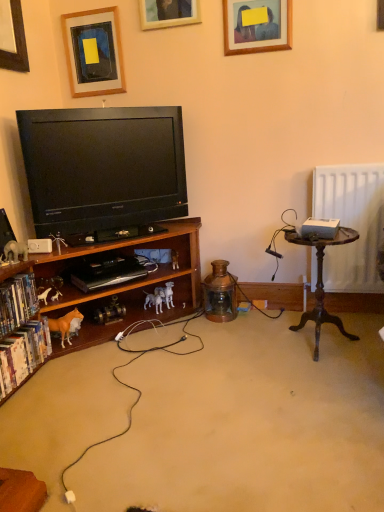
Question: Is wooden picture frame at upper center, which ranks as the 1th picture frame in right-to-left order, next to white plastic speaker at lower left?

Choices:
 (A) yes
 (B) no

Answer: (B)

Question: Can you confirm if wooden picture frame at upper center, which ranks as the 1th picture frame in right-to-left order, is bigger than white plastic speaker at lower left?

Choices:
 (A) no
 (B) yes

Answer: (B)

Question: Can we say wooden picture frame at upper center, positioned as the 3th picture frame in left-to-right order, lies outside white plastic speaker at lower left?

Choices:
 (A) yes
 (B) no

Answer: (A)

Question: Is white plastic speaker at lower left a part of wooden picture frame at upper center, positioned as the 3th picture frame in left-to-right order?

Choices:
 (A) no
 (B) yes

Answer: (A)

Question: Is wooden picture frame at upper center, which ranks as the 1th picture frame in right-to-left order, positioned far away from white plastic speaker at lower left?

Choices:
 (A) no
 (B) yes

Answer: (B)

Question: Is point (160, 305) closer or farther from the camera than point (26, 254)?

Choices:
 (A) farther
 (B) closer

Answer: (A)

Question: Considering the positions of white plastic dog at lower center, placed as the 4th toy when sorted from front to back, and matte white elephant at lower left, which appears as the fourth toy when viewed from the back, in the image, is white plastic dog at lower center, placed as the 4th toy when sorted from front to back, wider or thinner than matte white elephant at lower left, which appears as the fourth toy when viewed from the back,?

Choices:
 (A) wide
 (B) thin

Answer: (A)

Question: Is white plastic dog at lower center, which is the first toy in back-to-front order, bigger or smaller than matte white elephant at lower left, which appears as the fourth toy when viewed from the back?

Choices:
 (A) big
 (B) small

Answer: (A)

Question: From a real-world perspective, is white plastic dog at lower center, the third toy viewed from the left, positioned above or below matte white elephant at lower left, which is the 4th toy from right to left?

Choices:
 (A) above
 (B) below

Answer: (B)

Question: Is point (66, 314) closer or farther from the camera than point (49, 245)?

Choices:
 (A) farther
 (B) closer

Answer: (A)

Question: Looking at their shapes, would you say brown matte horse at lower left is wider or thinner than white plastic speaker at lower left?

Choices:
 (A) thin
 (B) wide

Answer: (B)

Question: From a real-world perspective, relative to white plastic speaker at lower left, is brown matte horse at lower left vertically above or below?

Choices:
 (A) below
 (B) above

Answer: (A)

Question: Is brown matte horse at lower left in front of or behind white plastic speaker at lower left in the image?

Choices:
 (A) front
 (B) behind

Answer: (B)

Question: Is hardcover books at lower left, the 1th book viewed from the top, inside or outside of brown plastic horse at lower left, arranged as the 3th toy when viewed from the right?

Choices:
 (A) outside
 (B) inside

Answer: (A)

Question: Looking at the image, does hardcover books at lower left, which is counted as the 2th book, starting from the bottom, seem bigger or smaller compared to brown plastic horse at lower left, arranged as the 3th toy when viewed from the right?

Choices:
 (A) big
 (B) small

Answer: (A)